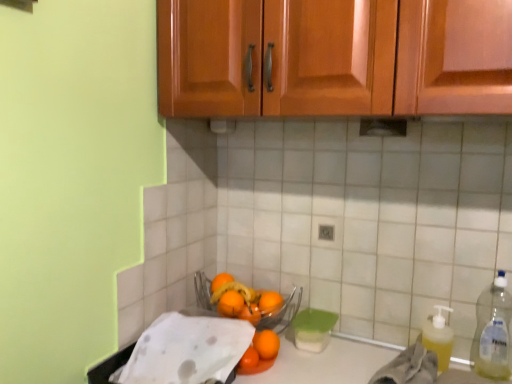
Question: From the image's perspective, relative to orange matte at center, which is the 1th orange in front-to-back order, is orange matte at center, the 4th orange in the front-to-back sequence, above or below?

Choices:
 (A) above
 (B) below

Answer: (A)

Question: In terms of height, does orange matte at center, acting as the 2th orange starting from the back, look taller or shorter compared to orange matte at center, the 5th orange from the back?

Choices:
 (A) tall
 (B) short

Answer: (B)

Question: Estimate the real-world distances between objects in this image. Which object is farther from the yellow translucent liquid at right?

Choices:
 (A) orange matte at center, acting as the 2th orange starting from the back
 (B) orange matte at center, arranged as the 3th orange when viewed from the back
 (C) orange matte at center, the 5th orange from the back
 (D) clear plastic bottle at right
 (E) yellow translucent liquid at lower right, positioned as the 2th material in left-to-right order

Answer: (A)

Question: Estimate the real-world distances between objects in this image. Which object is closer to the orange matte at center, arranged as the 3th orange when viewed from the back?

Choices:
 (A) orange matte at center, the 4th orange in the front-to-back sequence
 (B) clear plastic bottle at right
 (C) orange matte at center, the 5th orange from the back
 (D) orange matte at center, acting as the fifth orange starting from the front
 (E) orange matte at center, the 4th orange in the back-to-front sequence

Answer: (A)